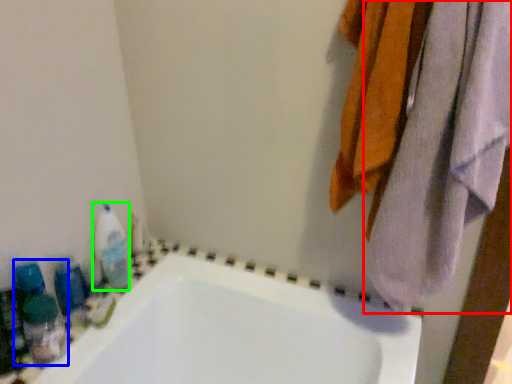
Question: Based on their relative distances, which object is farther from towel (highlighted by a red box)? Choose from cleaning product (highlighted by a blue box) and cleaning product (highlighted by a green box).

Choices:
 (A) cleaning product
 (B) cleaning product

Answer: (A)